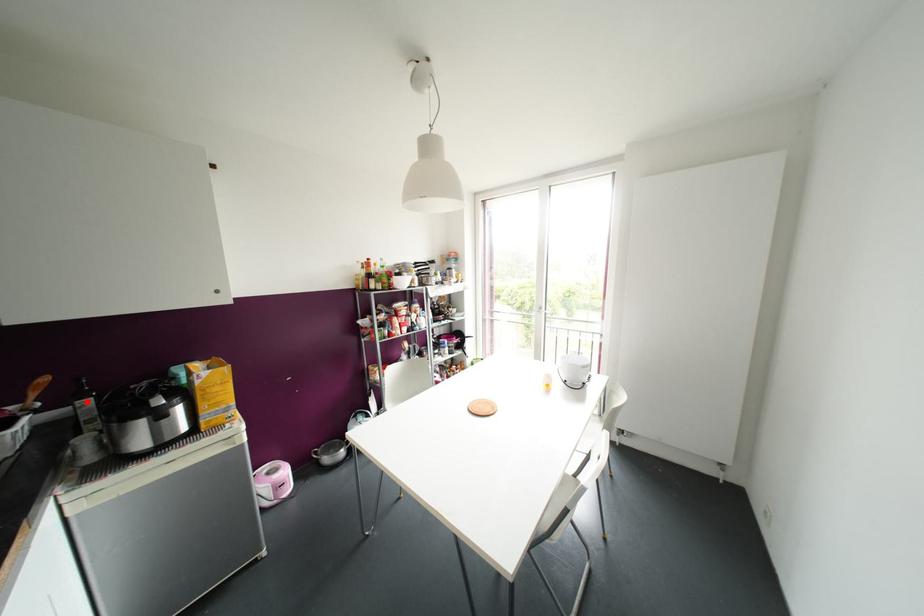
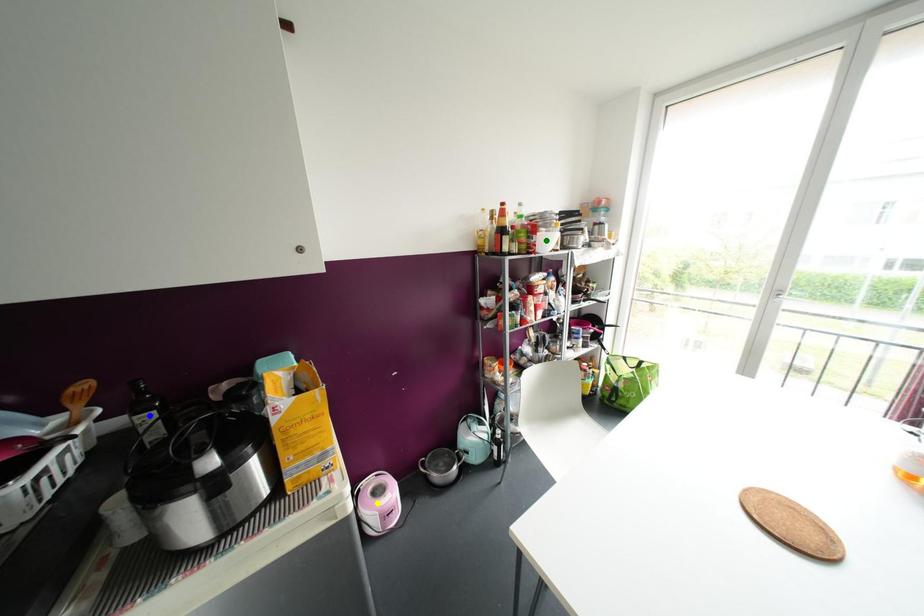
Question: I am providing you with two images of the same scene from different viewpoints. A red point is marked on the first image. You are given multiple points on the second image. Which mark in image 2 goes with the point in image 1?

Choices:
 (A) yellow point
 (B) green point
 (C) blue point

Answer: (C)